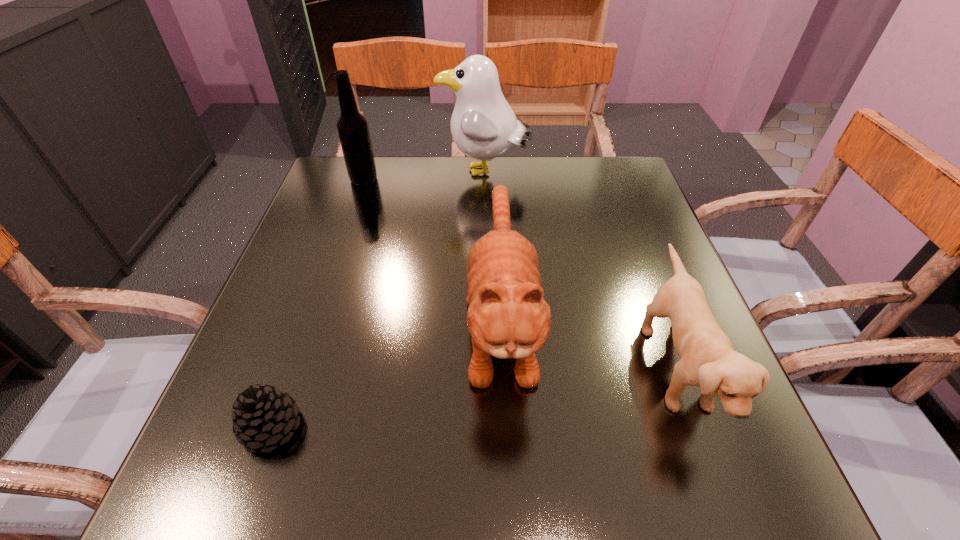
You are a GUI agent. You are given a task and a screenshot of the screen. Output one action in this format:
    pyautogui.click(x=<x>, y=<y>)
    Task: Click on the vacant space that is in between the pinecone and the puppy
    The height and width of the screenshot is (540, 960).
    Given the screenshot: What is the action you would take?
    pyautogui.click(x=473, y=397)

Where is `vacant area between the cat and the shortest object`? This screenshot has height=540, width=960. vacant area between the cat and the shortest object is located at coordinates (387, 373).

The image size is (960, 540). I want to click on vacant space that is in between the shortest object and the gull, so tap(378, 300).

Identify the location of vacant area between the cat and the shortest object. (387, 373).

Find the location of a particular element. blank region between the cat and the beer bottle is located at coordinates pyautogui.click(x=433, y=249).

Locate an element on the screen. The image size is (960, 540). free space between the gull and the beer bottle is located at coordinates (424, 176).

The width and height of the screenshot is (960, 540). What are the coordinates of `free space between the cat and the beer bottle` in the screenshot? It's located at (433, 249).

I want to click on vacant space in between the cat and the beer bottle, so click(x=433, y=249).

Image resolution: width=960 pixels, height=540 pixels. I want to click on object that ranks as the closest to the cat, so (x=708, y=359).

Identify which object is located as the nearest to the cat. Please provide its 2D coordinates. Your answer should be formatted as a tuple, i.e. [(x, y)], where the tuple contains the x and y coordinates of a point satisfying the conditions above.

[(708, 359)]